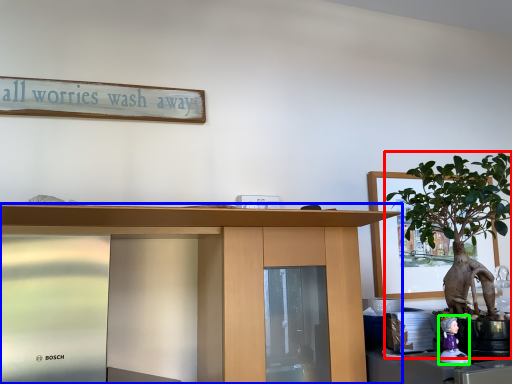
Question: Estimate the real-world distances between objects in this image. Which object is farther from houseplant (highlighted by a red box), desk (highlighted by a blue box) or toy (highlighted by a green box)?

Choices:
 (A) desk
 (B) toy

Answer: (A)